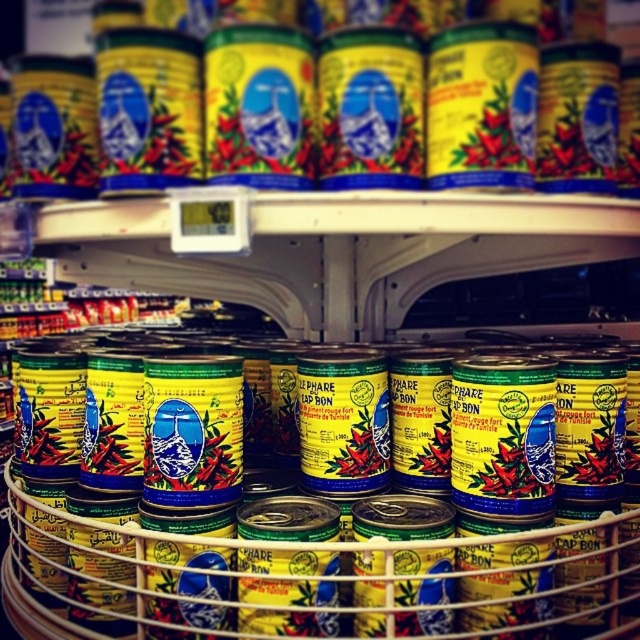
Between yellow matte can at center and yellow matte can at upper center, which one has more height?

yellow matte can at center

Based on the photo, can you confirm if yellow matte can at center is taller than yellow matte can at upper center?

Yes, yellow matte can at center is taller than yellow matte can at upper center.

This screenshot has height=640, width=640. What do you see at coordinates (326, 573) in the screenshot?
I see `yellow matte can at center` at bounding box center [326, 573].

Identify the location of yellow matte can at center. (326, 573).